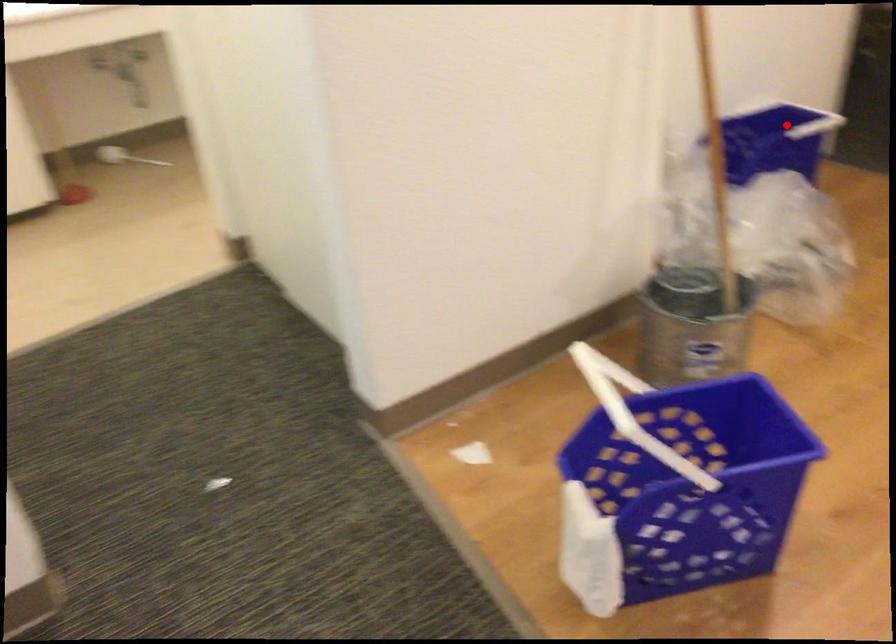
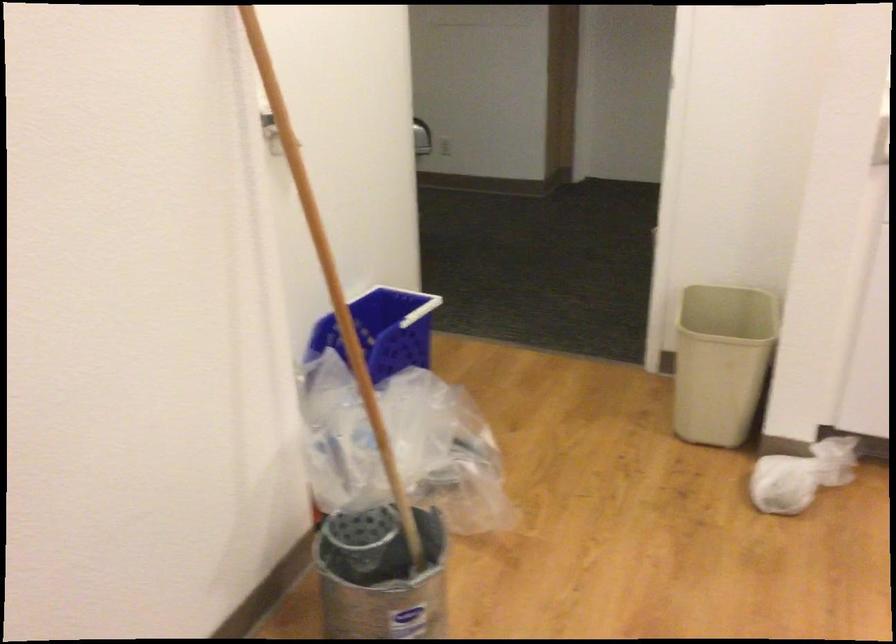
The point at the highlighted location is marked in the first image. Where is the corresponding point in the second image?

(407, 303)